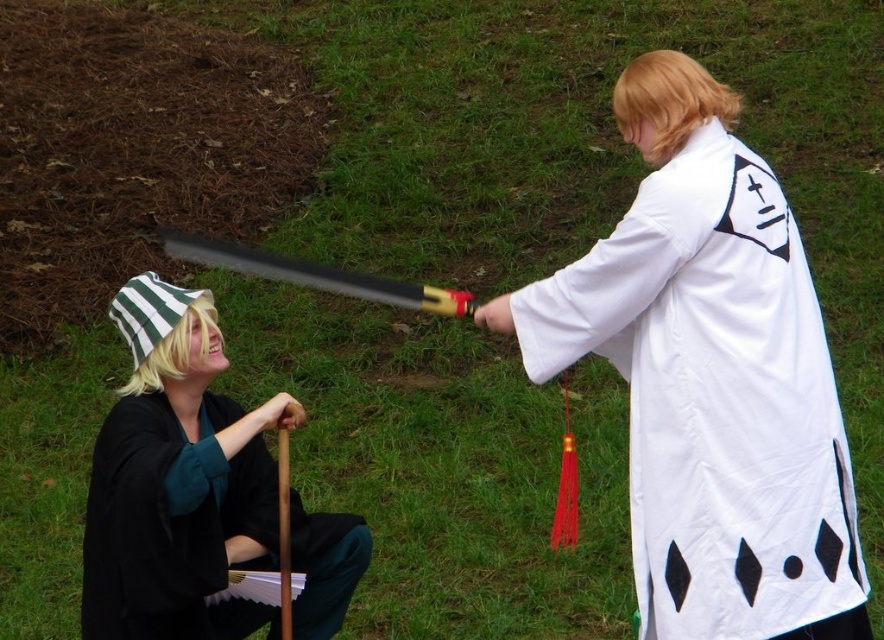
Question: Does white fabric kimono at upper right appear on the left side of black matte kimono at lower left?

Choices:
 (A) yes
 (B) no

Answer: (B)

Question: Among these objects, which one is farthest from the camera?

Choices:
 (A) black matte kimono at lower left
 (B) white fabric kimono at upper right

Answer: (B)

Question: Does white fabric kimono at upper right have a lesser width compared to black matte kimono at lower left?

Choices:
 (A) yes
 (B) no

Answer: (B)

Question: Does white fabric kimono at upper right have a smaller size compared to black matte kimono at lower left?

Choices:
 (A) yes
 (B) no

Answer: (B)

Question: Among these points, which one is farthest from the camera?

Choices:
 (A) (202, 384)
 (B) (733, 301)

Answer: (A)